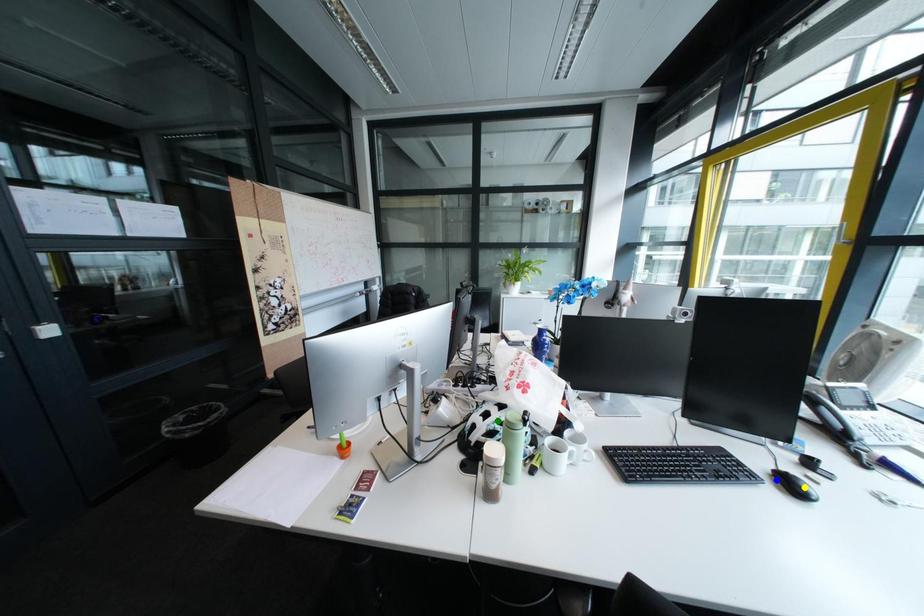
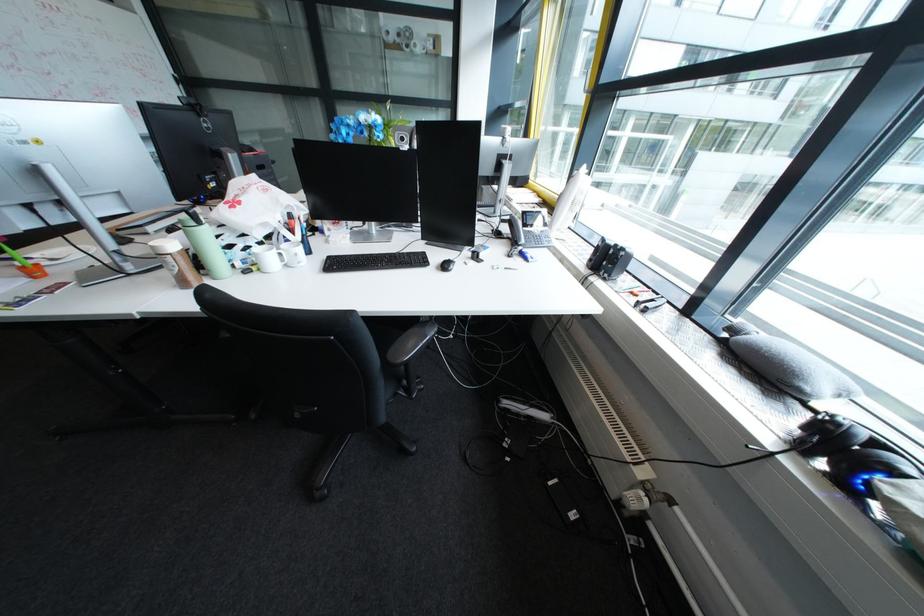
I am providing you with two images of the same scene from different viewpoints. Three points are marked in image1. Which point corresponds to a part or object that is occluded in image2?In image1, three points are marked. Which of them correspond to a part or object that is occluded in image2?Among the three points shown in image1, which one corresponds to a part or object that is no longer visible due to occlusion in image2?

Invisible in image2: green point, yellow point.